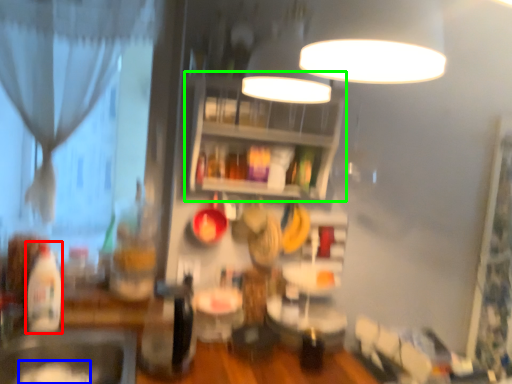
Question: Estimate the real-world distances between objects in this image. Which object is farther from bottle (highlighted by a red box), food (highlighted by a blue box) or shelf (highlighted by a green box)?

Choices:
 (A) food
 (B) shelf

Answer: (B)